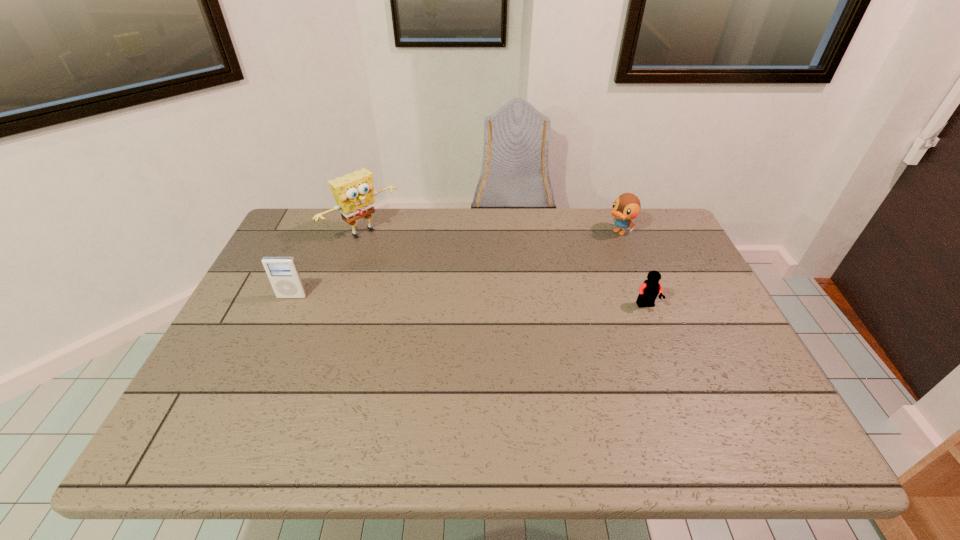
The image size is (960, 540). In order to click on iPod in this screenshot , I will do `click(282, 272)`.

Locate an element on the screen. The width and height of the screenshot is (960, 540). Lego is located at coordinates (648, 291).

Locate an element on the screen. the nearest object is located at coordinates (648, 291).

The height and width of the screenshot is (540, 960). Find the location of `the tallest object`. the tallest object is located at coordinates (354, 193).

The width and height of the screenshot is (960, 540). I want to click on duck, so click(x=626, y=207).

Locate an element on the screen. This screenshot has height=540, width=960. vacant space located 0.300m on the front-facing side of the second nearest object is located at coordinates (247, 396).

What are the coordinates of `free region located on the front-facing side of the Lego` in the screenshot? It's located at (x=674, y=376).

The image size is (960, 540). In order to click on free space located on the face of the sponge in this screenshot , I will do `click(398, 261)`.

Locate an element on the screen. This screenshot has width=960, height=540. vacant region located on the face of the sponge is located at coordinates (423, 282).

Identify the location of blank area located 0.310m on the face of the sponge. (445, 301).